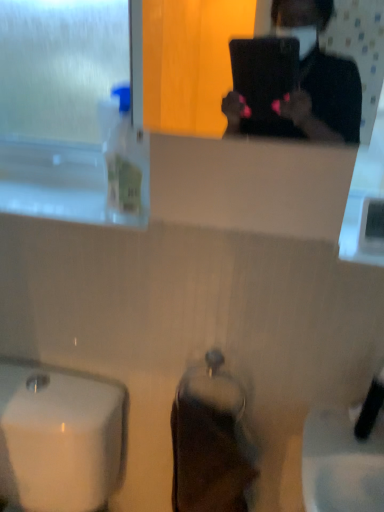
Question: Considering the relative positions of clear plastic bottle at left and frosted glass window screen at upper left in the image provided, is clear plastic bottle at left behind frosted glass window screen at upper left?

Choices:
 (A) no
 (B) yes

Answer: (A)

Question: Does clear plastic bottle at left have a greater height compared to frosted glass window screen at upper left?

Choices:
 (A) yes
 (B) no

Answer: (B)

Question: Is frosted glass window screen at upper left inside clear plastic bottle at left?

Choices:
 (A) no
 (B) yes

Answer: (A)

Question: Is clear plastic bottle at left positioned beyond the bounds of frosted glass window screen at upper left?

Choices:
 (A) no
 (B) yes

Answer: (B)

Question: Considering the relative sizes of clear plastic bottle at left and frosted glass window screen at upper left in the image provided, is clear plastic bottle at left smaller than frosted glass window screen at upper left?

Choices:
 (A) no
 (B) yes

Answer: (B)

Question: Considering the positions of black matte laptop at upper center and clear plastic bottle at left in the image, is black matte laptop at upper center bigger or smaller than clear plastic bottle at left?

Choices:
 (A) big
 (B) small

Answer: (A)

Question: Considering the relative positions of black matte laptop at upper center and clear plastic bottle at left in the image provided, is black matte laptop at upper center to the left or to the right of clear plastic bottle at left?

Choices:
 (A) right
 (B) left

Answer: (A)

Question: Looking at their shapes, would you say black matte laptop at upper center is wider or thinner than clear plastic bottle at left?

Choices:
 (A) wide
 (B) thin

Answer: (B)

Question: Is black matte laptop at upper center taller or shorter than clear plastic bottle at left?

Choices:
 (A) tall
 (B) short

Answer: (A)

Question: Looking at their shapes, would you say frosted glass window screen at upper left is wider or thinner than black matte laptop at upper center?

Choices:
 (A) wide
 (B) thin

Answer: (A)

Question: From the image's perspective, is frosted glass window screen at upper left positioned above or below black matte laptop at upper center?

Choices:
 (A) above
 (B) below

Answer: (A)

Question: Would you say frosted glass window screen at upper left is inside or outside black matte laptop at upper center?

Choices:
 (A) inside
 (B) outside

Answer: (B)

Question: In terms of size, does frosted glass window screen at upper left appear bigger or smaller than black matte laptop at upper center?

Choices:
 (A) small
 (B) big

Answer: (B)

Question: From a real-world perspective, is clear plastic bottle at left physically located above or below white glossy sink at lower left?

Choices:
 (A) above
 (B) below

Answer: (A)

Question: From their relative heights in the image, would you say clear plastic bottle at left is taller or shorter than white glossy sink at lower left?

Choices:
 (A) tall
 (B) short

Answer: (B)